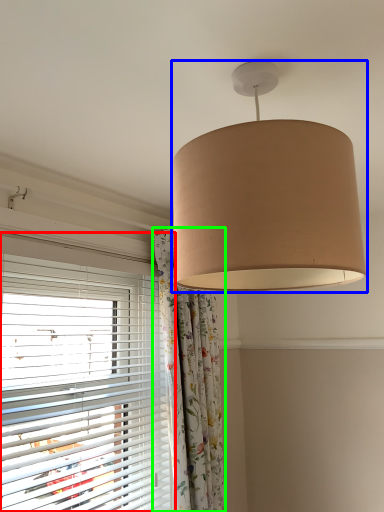
Question: Which object is the farthest from window blind (highlighted by a red box)? Choose among these: lamp (highlighted by a blue box) or curtain (highlighted by a green box).

Choices:
 (A) lamp
 (B) curtain

Answer: (A)